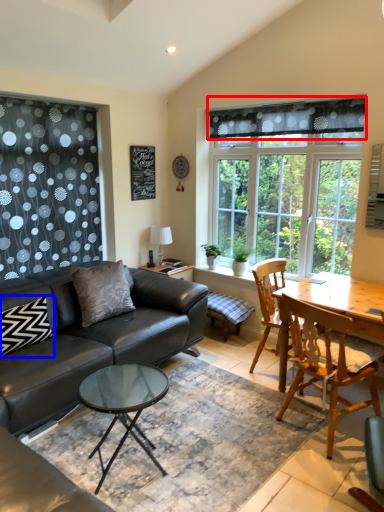
Question: Which point is closer to the camera, curtain (highlighted by a red box) or pillow (highlighted by a blue box)?

Choices:
 (A) curtain
 (B) pillow

Answer: (B)